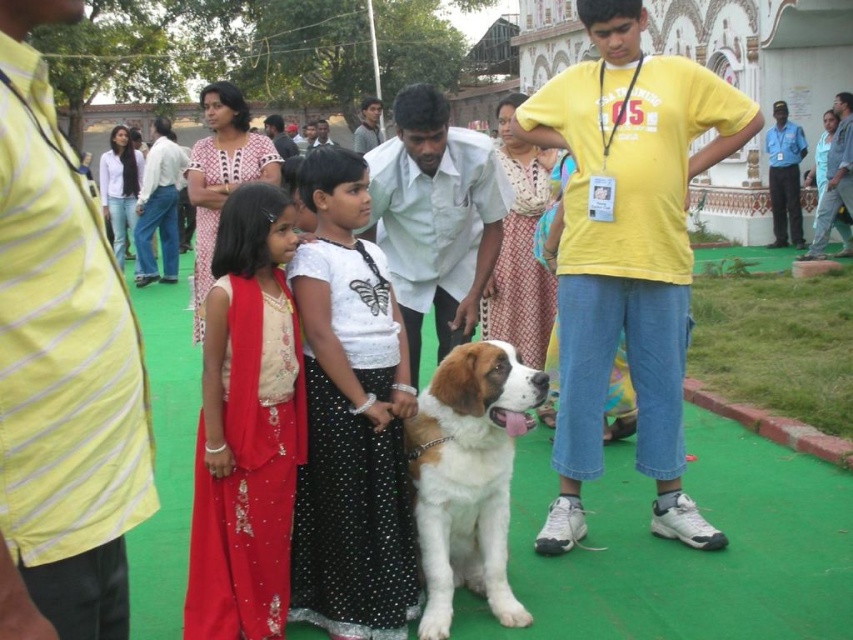
You are a photographer at the event and want to capture a photo of both the shiny red dress at center and the white fur with brown patches at center. Which object should you focus on first if you want to ensure both are in frame without moving the camera?

You should focus on the shiny red dress at center first because its width is larger than the white fur with brown patches at center, so centering it will ensure both are in frame.

What are the coordinates of the white dotted skirt at center?

The white dotted skirt at center is located at coordinates point (350, 419).